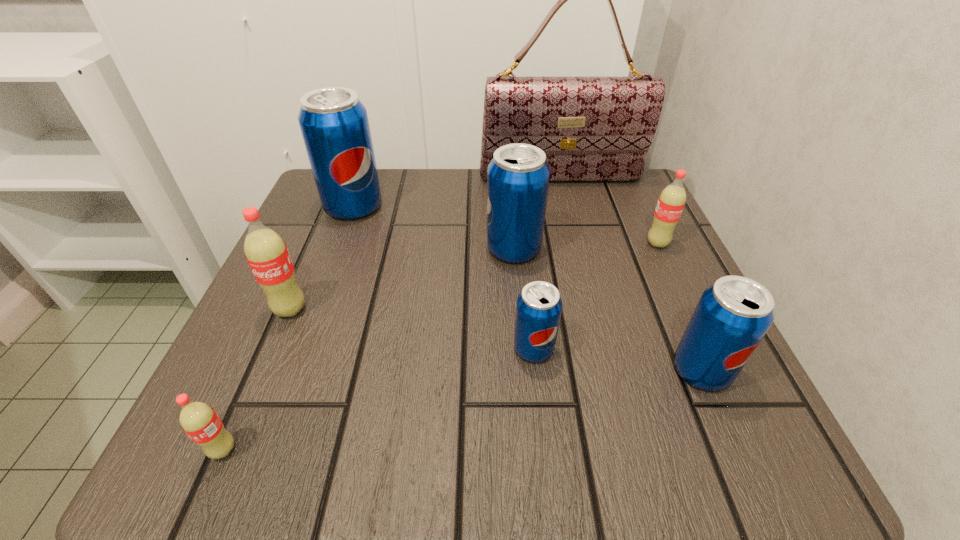
I want to click on the smallest blue pop soda, so coord(538,311).

Find the location of a particular element. the nearest object is located at coordinates (198, 420).

Where is `the smallest red soda`? the smallest red soda is located at coordinates (198, 420).

Where is `free region located 0.270m on the front of the tallest object with the clasp`? This screenshot has height=540, width=960. free region located 0.270m on the front of the tallest object with the clasp is located at coordinates (583, 268).

The height and width of the screenshot is (540, 960). What are the coordinates of `free space located 0.150m on the right of the farthest blue pop soda` in the screenshot? It's located at (453, 206).

Locate an element on the screen. The height and width of the screenshot is (540, 960). free space located on the right of the second farthest blue pop soda is located at coordinates (578, 249).

What are the coordinates of `vacant space located on the back of the fourth nearest soda` in the screenshot? It's located at (336, 201).

You are a GUI agent. You are given a task and a screenshot of the screen. Output one action in this format:
    pyautogui.click(x=<x>, y=<y>)
    Task: Click on the free region located on the front of the rightmost red soda
    The width and height of the screenshot is (960, 540).
    Given the screenshot: What is the action you would take?
    pyautogui.click(x=705, y=343)

Identify the location of free point located on the left of the rightmost blue pop soda. (465, 370).

Identify the location of blank space located on the back of the smallest blue pop soda. (518, 208).